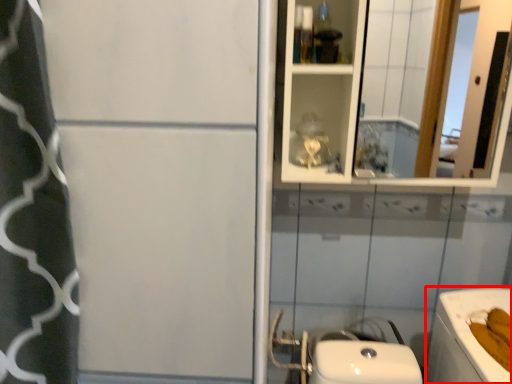
Question: Considering the relative positions of bath (annotated by the red box) and mirror in the image provided, where is bath (annotated by the red box) located with respect to the staircase?

Choices:
 (A) left
 (B) right

Answer: (B)